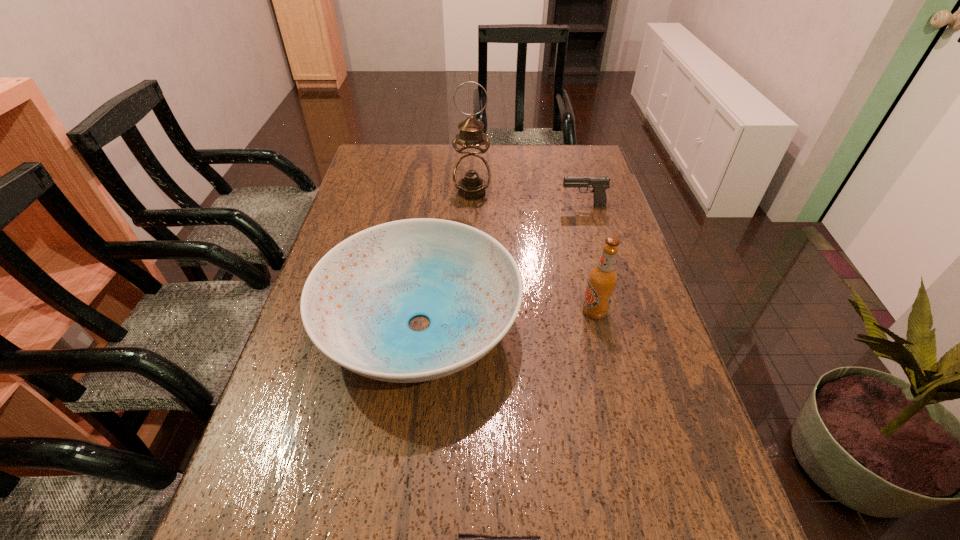
The height and width of the screenshot is (540, 960). In the image, there is a desktop. What are the coordinates of `vacant space at the far left corner` in the screenshot? It's located at tap(363, 159).

At what (x,y) coordinates should I click in order to perform the action: click on vacant space at the far right corner of the desktop. Please return your answer as a coordinate pair (x, y). This screenshot has height=540, width=960. Looking at the image, I should click on (588, 147).

The height and width of the screenshot is (540, 960). Find the location of `unoccupied position between the beer bottle and the pistol`. unoccupied position between the beer bottle and the pistol is located at coordinates coord(588,258).

At what (x,y) coordinates should I click in order to perform the action: click on object that can be found as the closest to the fourth tallest object. Please return your answer as a coordinate pair (x, y). The image size is (960, 540). Looking at the image, I should click on (471, 175).

What are the coordinates of `object identified as the fourth closest to the flashlight` in the screenshot? It's located at (471, 175).